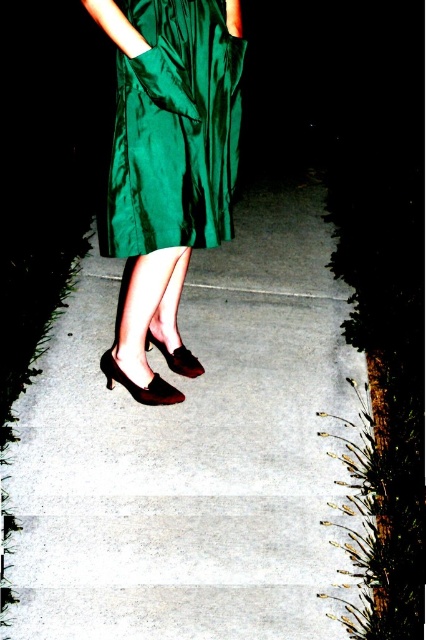
You are a photographer trying to capture the best shot of the person in the green dress. You have two points marked on your camera screen at coordinates point (x=226, y=385) and point (x=196, y=372). Which point is closer to the person in the green dress?

Point (x=226, y=385) is further to the viewer than point (x=196, y=372), so the closer point to the person in the green dress is point (x=196, y=372).